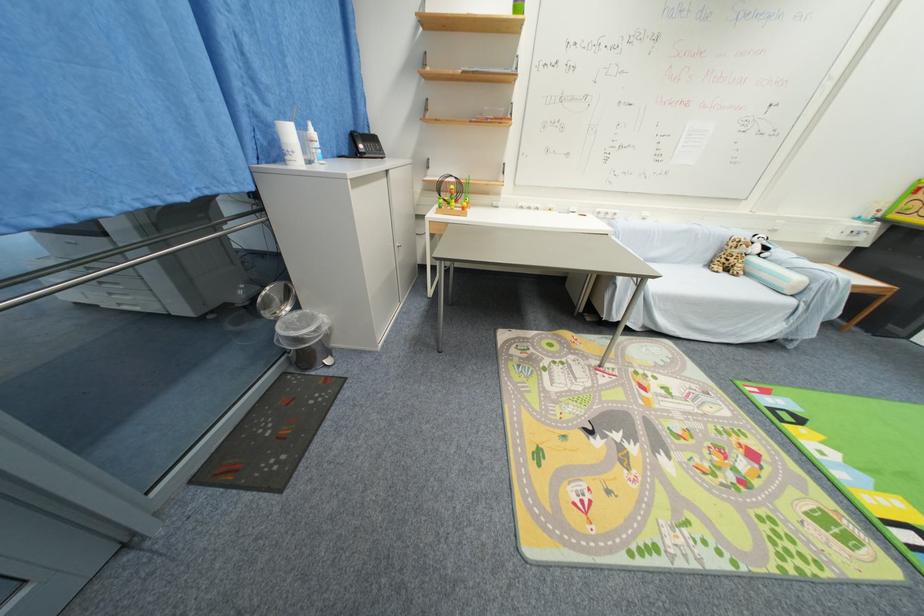
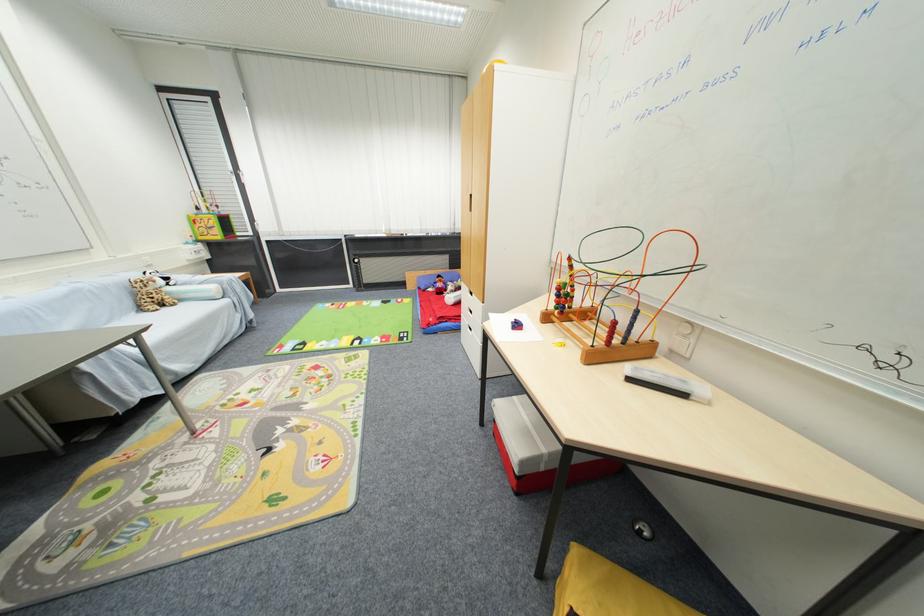
Locate, in the second image, the point that corresponds to (714,265) in the first image.

(146, 310)